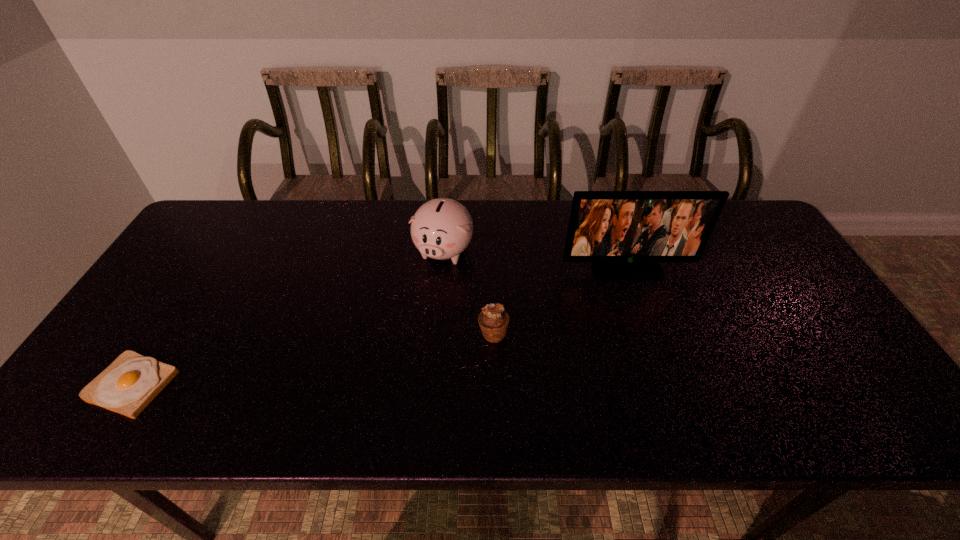
Image resolution: width=960 pixels, height=540 pixels. What are the coordinates of `object that can be found as the closest to the third farthest object` in the screenshot? It's located at (442, 228).

At what (x,y) coordinates should I click in order to perform the action: click on object that is the third closest one to the tallest object. Please return your answer as a coordinate pair (x, y). The image size is (960, 540). Looking at the image, I should click on coord(127,386).

Image resolution: width=960 pixels, height=540 pixels. I want to click on vacant space that satisfies the following two spatial constraints: 1. on the back side of the piggy bank; 2. on the right side of the leftmost object, so click(x=217, y=251).

Find the location of a particular element. vacant space that satisfies the following two spatial constraints: 1. on the back side of the piggy bank; 2. on the right side of the toast is located at coordinates (217, 251).

You are a GUI agent. You are given a task and a screenshot of the screen. Output one action in this format:
    pyautogui.click(x=<x>, y=<y>)
    Task: Click on the vacant region that satisfies the following two spatial constraints: 1. on the front side of the third object from left to right; 2. on the right side of the third object from right to left
    
    Given the screenshot: What is the action you would take?
    pyautogui.click(x=436, y=334)